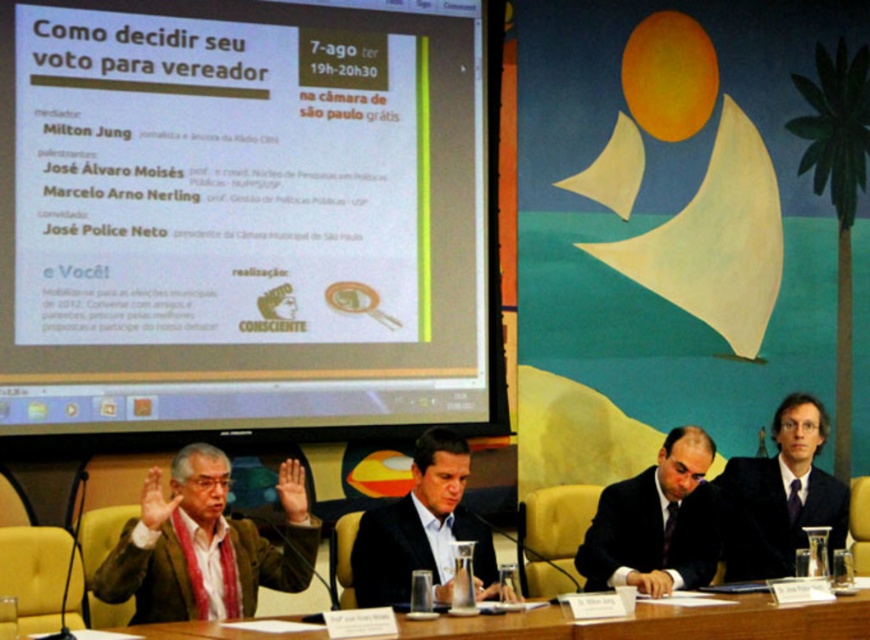
At what (x,y) coordinates should I click in order to perform the action: click on dark brown leather jacket at center. Please return your answer as a coordinate pair (x, y). Looking at the image, I should click on (146, 577).

Is dark brown leather jacket at center taller than black matte suit at center?

Incorrect, dark brown leather jacket at center's height is not larger of black matte suit at center's.

This screenshot has width=870, height=640. Describe the element at coordinates (146, 577) in the screenshot. I see `dark brown leather jacket at center` at that location.

In order to click on dark brown leather jacket at center in this screenshot , I will do click(146, 577).

Can you confirm if wooden table at center is shorter than dark blue suit at center?

Yes.

Who is more forward, (693, 614) or (693, 513)?

Point (693, 614) is in front.

This screenshot has width=870, height=640. I want to click on wooden table at center, so pos(660,621).

Between dark brown leather jacket at center and black satin suit at right, which one is positioned lower?

dark brown leather jacket at center is below.

Can you confirm if dark brown leather jacket at center is positioned to the right of black satin suit at right?

No, dark brown leather jacket at center is not to the right of black satin suit at right.

Image resolution: width=870 pixels, height=640 pixels. Identify the location of dark brown leather jacket at center. (146, 577).

The image size is (870, 640). Find the location of `dark brown leather jacket at center`. dark brown leather jacket at center is located at coordinates (146, 577).